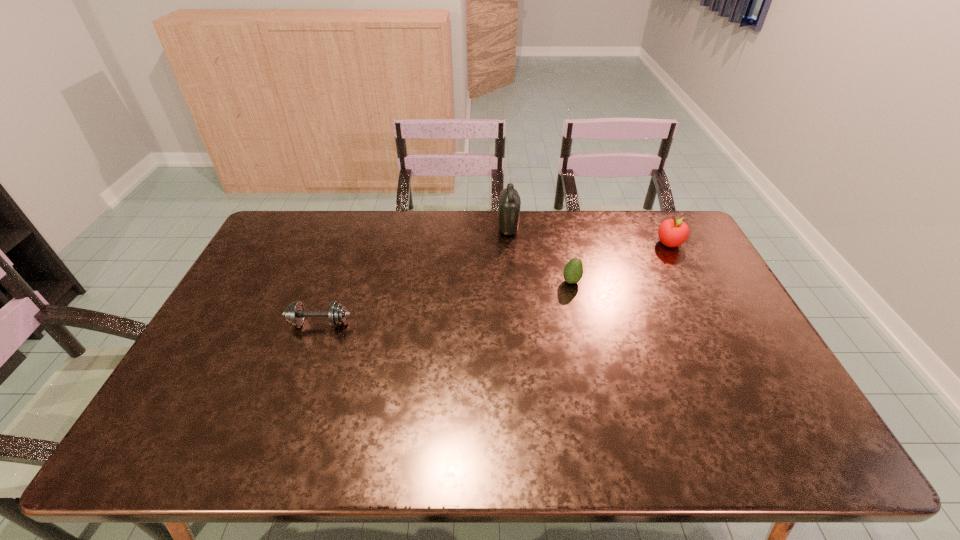
Identify the location of free point between the tallest object and the rightmost object. This screenshot has height=540, width=960. click(x=589, y=236).

Where is `blank region between the bottle and the dumbbell`? Image resolution: width=960 pixels, height=540 pixels. blank region between the bottle and the dumbbell is located at coordinates (414, 276).

Where is `unoccupied position between the second tallest object and the third tallest object`? unoccupied position between the second tallest object and the third tallest object is located at coordinates (620, 262).

At what (x,y) coordinates should I click in order to perform the action: click on free space between the rightmost object and the second nearest object. Please return your answer as a coordinate pair (x, y). Image resolution: width=960 pixels, height=540 pixels. Looking at the image, I should click on (620, 262).

Identify the location of free space between the shortest object and the tallest object. (414, 276).

Image resolution: width=960 pixels, height=540 pixels. Find the location of `empty space that is in between the tallest object and the dumbbell`. empty space that is in between the tallest object and the dumbbell is located at coordinates (414, 276).

This screenshot has width=960, height=540. In order to click on free space between the second nearest object and the shortest object in this screenshot , I will do [x=445, y=302].

I want to click on vacant area between the shortest object and the avocado, so click(445, 302).

Locate an element on the screen. The width and height of the screenshot is (960, 540). vacant point located between the second object from right to left and the second tallest object is located at coordinates (620, 262).

Locate an element on the screen. The height and width of the screenshot is (540, 960). free spot between the third tallest object and the nearest object is located at coordinates (445, 302).